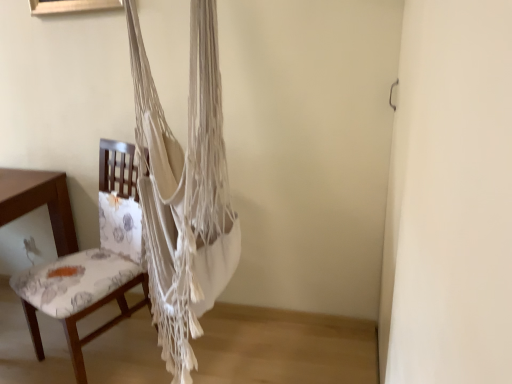
Locate an element on the screen. The height and width of the screenshot is (384, 512). floral fabric chair at left is located at coordinates (51, 223).

Looking at this image, measure the distance between point (24, 302) and camera.

The distance of point (24, 302) from camera is 6.08 feet.

What do you see at coordinates (51, 223) in the screenshot? The height and width of the screenshot is (384, 512). I see `floral fabric chair at left` at bounding box center [51, 223].

What do you see at coordinates (184, 192) in the screenshot? The image size is (512, 384). I see `white macrame hammock at center` at bounding box center [184, 192].

You are a GUI agent. You are given a task and a screenshot of the screen. Output one action in this format:
    pyautogui.click(x=<x>, y=<y>)
    Task: Click on the white macrame hammock at center
    
    Given the screenshot: What is the action you would take?
    pyautogui.click(x=184, y=192)

What are the coordinates of `floral fabric chair at left` in the screenshot? It's located at (51, 223).

Which object is positioned more to the right, floral fabric chair at left or white macrame hammock at center?

white macrame hammock at center.

Which object is further away from the camera, floral fabric chair at left or white macrame hammock at center?

Positioned behind is floral fabric chair at left.

Between point (78, 318) and point (198, 229), which one is positioned behind?

Point (78, 318)

From the image's perspective, would you say floral fabric chair at left is shown under white macrame hammock at center?

Yes, from the image's perspective, floral fabric chair at left is beneath white macrame hammock at center.

From a real-world perspective, between floral fabric chair at left and white macrame hammock at center, who is vertically lower?

floral fabric chair at left is physically lower.

Considering the sizes of objects floral fabric chair at left and white macrame hammock at center in the image provided, who is wider, floral fabric chair at left or white macrame hammock at center?

floral fabric chair at left is wider.

Does floral fabric chair at left have a lesser height compared to white macrame hammock at center?

Indeed, floral fabric chair at left has a lesser height compared to white macrame hammock at center.

Between floral fabric chair at left and white macrame hammock at center, which one has smaller size?

With smaller size is floral fabric chair at left.

Could white macrame hammock at center be considered to be inside floral fabric chair at left?

Definitely not — white macrame hammock at center is not inside floral fabric chair at left.

Is floral fabric chair at left with white macrame hammock at center?

A: No, floral fabric chair at left is not in contact with white macrame hammock at center.

Is floral fabric chair at left positioned with its back to white macrame hammock at center?

Absolutely, floral fabric chair at left is directed away from white macrame hammock at center.

How many degrees apart are the facing directions of floral fabric chair at left and white macrame hammock at center?

floral fabric chair at left and white macrame hammock at center are facing 26.6 degrees away from each other.

The image size is (512, 384). I want to click on chair on the left of white macrame hammock at center, so click(51, 223).

In the image, is white macrame hammock at center on the left side or the right side of floral fabric chair at left?

Based on their positions, white macrame hammock at center is located to the right of floral fabric chair at left.

Is white macrame hammock at center in front of floral fabric chair at left?

Yes, it is.

Which is behind, point (170, 231) or point (106, 168)?

Point (106, 168)

From the image's perspective, is white macrame hammock at center above or below floral fabric chair at left?

Clearly, from the image's perspective, white macrame hammock at center is above floral fabric chair at left.

In the scene shown: From a real-world perspective, which object stands above the other?

white macrame hammock at center, from a real-world perspective.

From the picture: Considering the sizes of objects white macrame hammock at center and floral fabric chair at left in the image provided, who is thinner, white macrame hammock at center or floral fabric chair at left?

With smaller width is white macrame hammock at center.

From the picture: Can you confirm if white macrame hammock at center is taller than floral fabric chair at left?

Yes.

Between white macrame hammock at center and floral fabric chair at left, which one has larger size?

white macrame hammock at center is bigger.

Can floral fabric chair at left be found inside white macrame hammock at center?

No, floral fabric chair at left is located outside of white macrame hammock at center.

Is white macrame hammock at center far from floral fabric chair at left?

That's not correct — white macrame hammock at center is a little close to floral fabric chair at left.

From the picture: Could you tell me if white macrame hammock at center is facing floral fabric chair at left?

Yes, white macrame hammock at center is facing floral fabric chair at left.

How many degrees apart are the facing directions of white macrame hammock at center and floral fabric chair at left?

26.6 degrees.

Measure the distance between white macrame hammock at center and floral fabric chair at left.

They are 15.67 inches apart.

Image resolution: width=512 pixels, height=384 pixels. Identify the location of curtain above the floral fabric chair at left (from the image's perspective). (184, 192).

Locate an element on the screen. The width and height of the screenshot is (512, 384). curtain above the floral fabric chair at left (from the image's perspective) is located at coordinates (184, 192).

Image resolution: width=512 pixels, height=384 pixels. I want to click on chair below the white macrame hammock at center (from a real-world perspective), so (x=51, y=223).